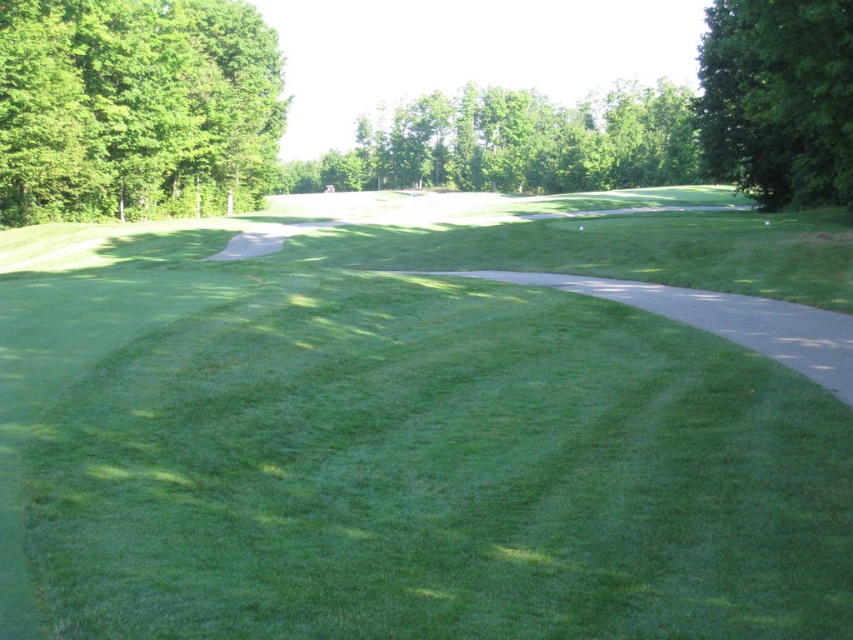
Does green leafy tree at left appear over green leafy tree at upper center?

No, green leafy tree at left is not above green leafy tree at upper center.

Who is lower down, green leafy tree at left or green leafy tree at upper center?

green leafy tree at left is below.

I want to click on green leafy tree at left, so click(x=136, y=108).

Can you confirm if green leafy tree at left is shorter than green leafy tree at upper right?

No, green leafy tree at left is not shorter than green leafy tree at upper right.

Which is in front, point (120, 81) or point (747, 125)?

Point (747, 125) is in front.

Between point (57, 20) and point (724, 141), which one is positioned behind?

The point (724, 141) is more distant.

At what (x,y) coordinates should I click in order to perform the action: click on green leafy tree at left. Please return your answer as a coordinate pair (x, y). The image size is (853, 640). Looking at the image, I should click on (136, 108).

Can you confirm if green leafy tree at upper center is shorter than green leafy tree at upper right?

Incorrect, green leafy tree at upper center's height does not fall short of green leafy tree at upper right's.

Where is `green leafy tree at upper center`? The width and height of the screenshot is (853, 640). green leafy tree at upper center is located at coordinates (515, 144).